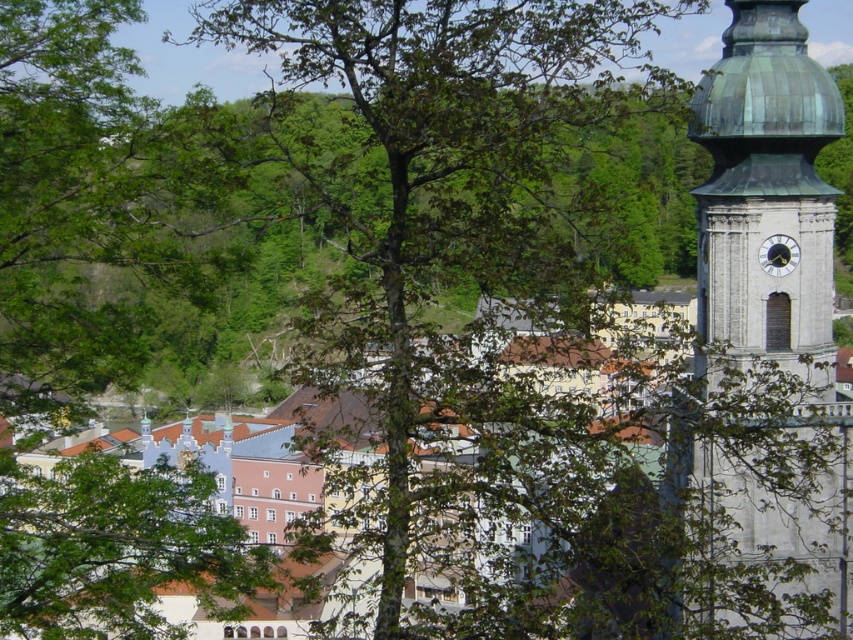
In the scene shown: Is green copper dome at right bigger than white metallic clock at upper right?

Yes.

Is point (809, 586) farther from viewer compared to point (791, 264)?

No.

Who is more forward, (805, 365) or (792, 241)?

Point (805, 365)

Find the location of `green copper dome at right`. green copper dome at right is located at coordinates (767, 195).